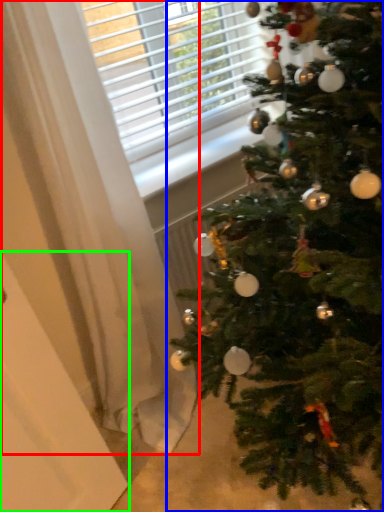
Question: Estimate the real-world distances between objects in this image. Which object is farther from curtain (highlighted by a red box), christmas tree (highlighted by a blue box) or screen door (highlighted by a green box)?

Choices:
 (A) christmas tree
 (B) screen door

Answer: (A)